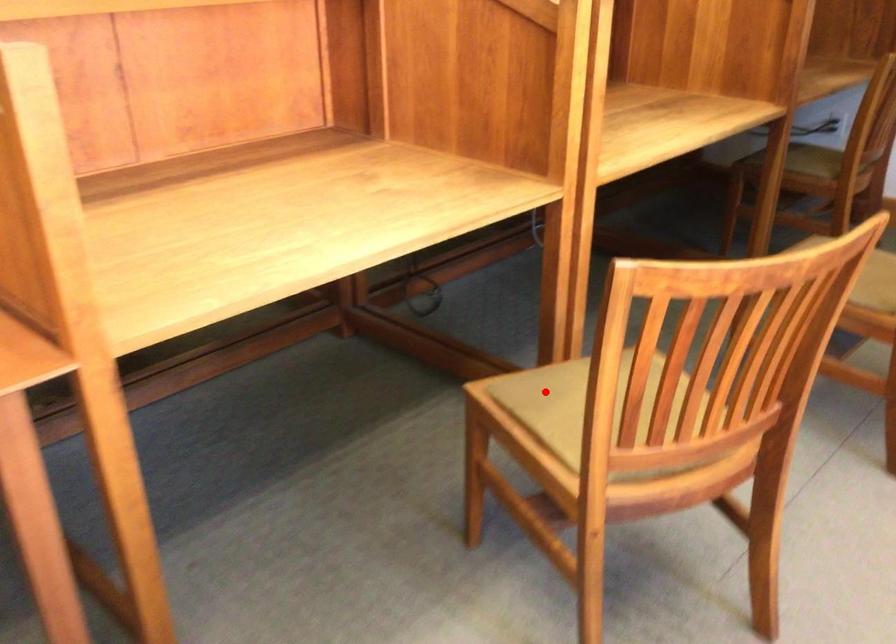
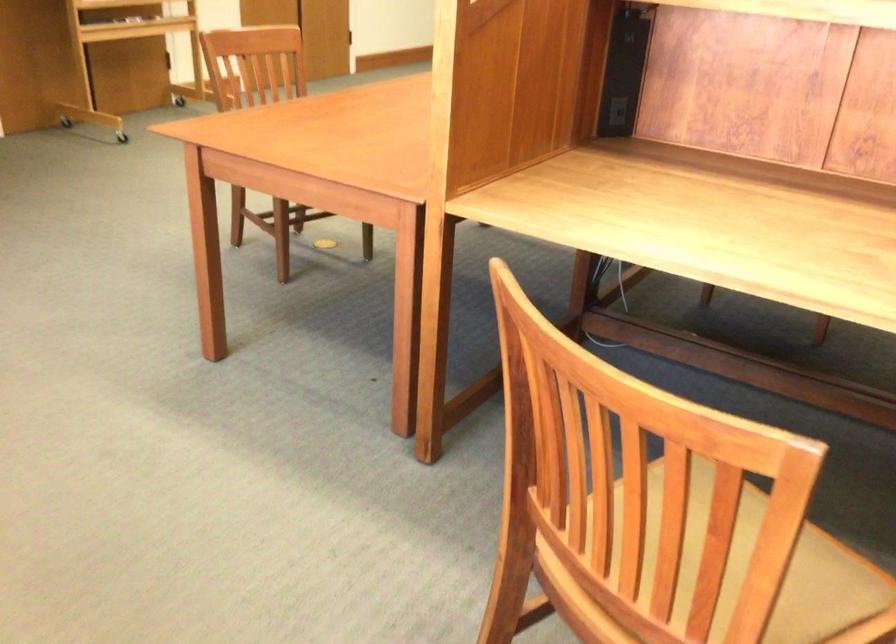
Question: I am providing you with two images of the same scene from different viewpoints. A red point is marked on the first image. Is the red point's position out of view in image 2?

Choices:
 (A) Yes
 (B) No

Answer: (A)